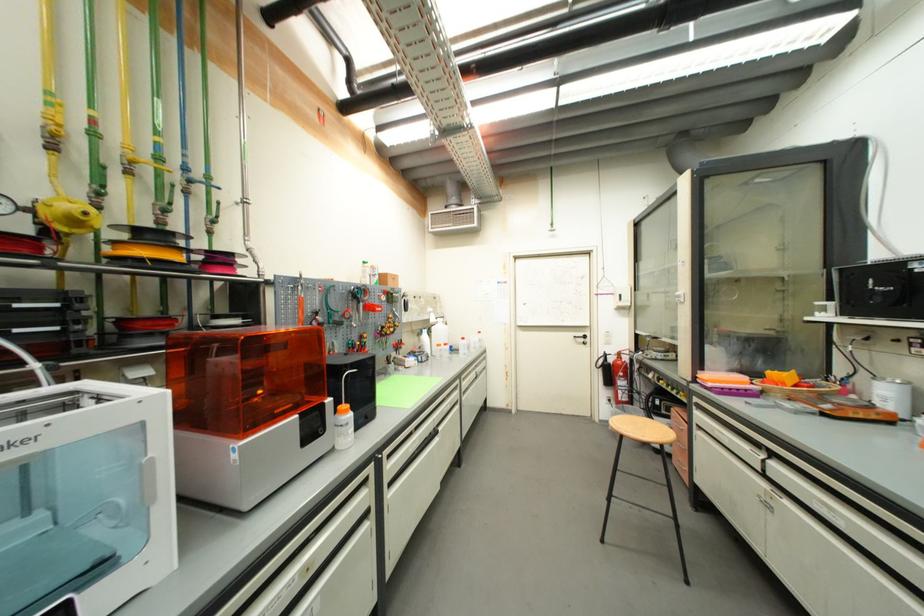
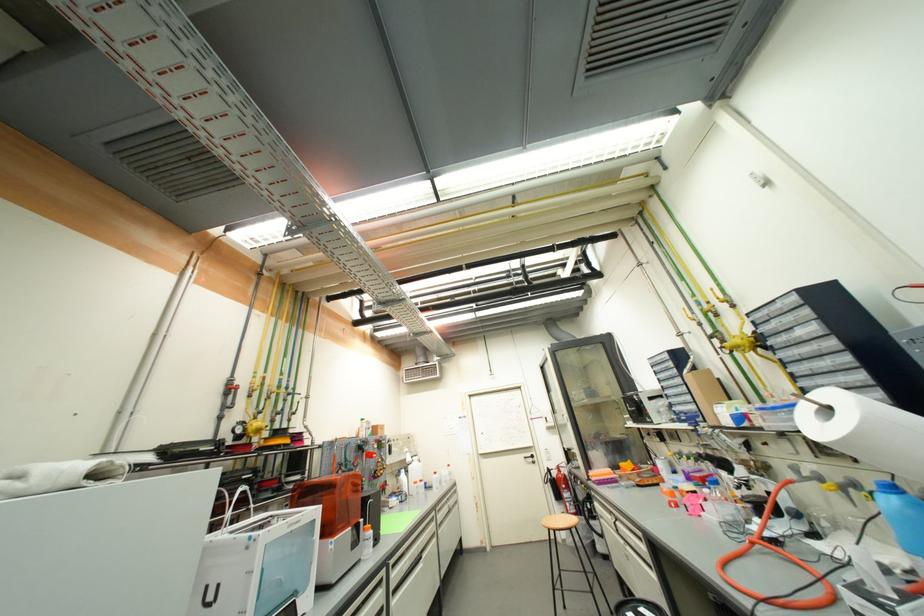
The point at [468,392] is marked in the first image. Where is the corresponding point in the second image?

(444, 525)